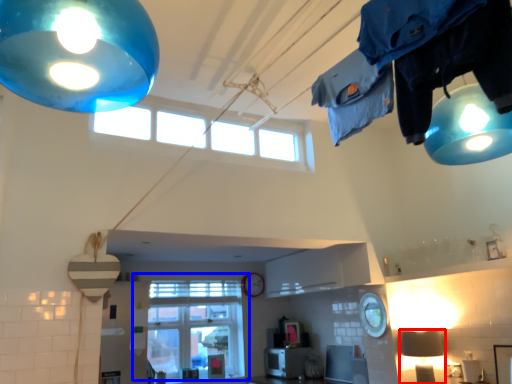
Question: Which object appears closest to the camera in this image, lamp (highlighted by a red box) or window (highlighted by a blue box)?

Choices:
 (A) lamp
 (B) window

Answer: (A)